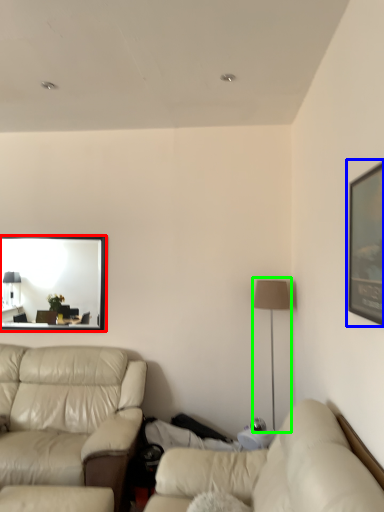
Question: Which is farther away from mirror (highlighted by a red box)? picture frame (highlighted by a blue box) or table lamp (highlighted by a green box)?

Choices:
 (A) picture frame
 (B) table lamp

Answer: (A)